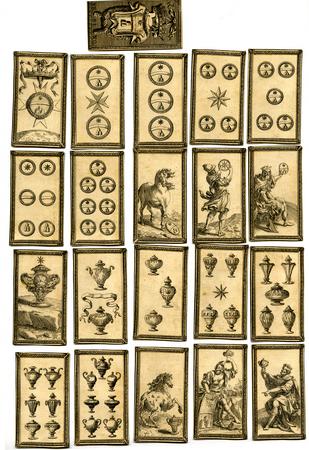
Find the location of a particular element. The width and height of the screenshot is (309, 450). frame is located at coordinates (245, 304), (252, 310).